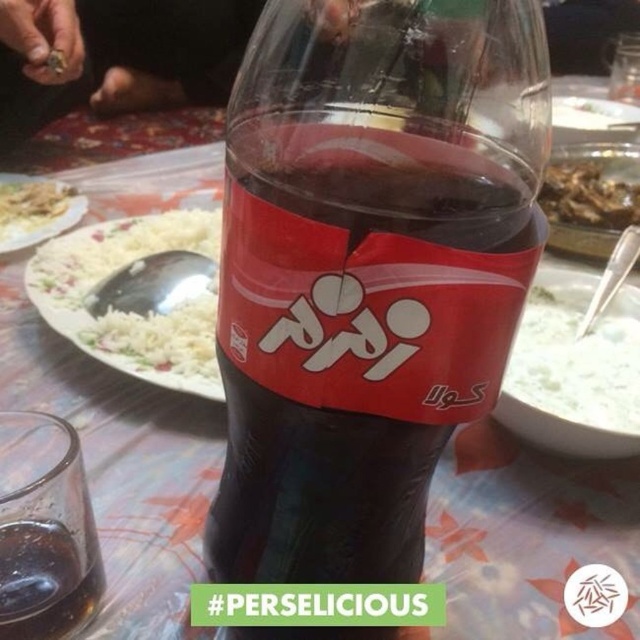
Question: Is white creamy yogurt at center positioned at the back of transparent glass at lower left?

Choices:
 (A) yes
 (B) no

Answer: (B)

Question: Which point appears farthest from the camera in this image?

Choices:
 (A) [40, 225]
 (B) [35, 600]

Answer: (A)

Question: Which of the following is the farthest from the observer?

Choices:
 (A) transparent glass at lower left
 (B) matte plastic bottle at center

Answer: (A)

Question: Is white rice at center in front of transparent glass at lower left?

Choices:
 (A) yes
 (B) no

Answer: (B)

Question: Which point is closer to the camera taking this photo?

Choices:
 (A) (164, 243)
 (B) (531, 42)
 (C) (97, 600)
 (D) (54, 211)

Answer: (B)

Question: Can you confirm if white rice at center is positioned to the right of white rice at upper left?

Choices:
 (A) no
 (B) yes

Answer: (B)